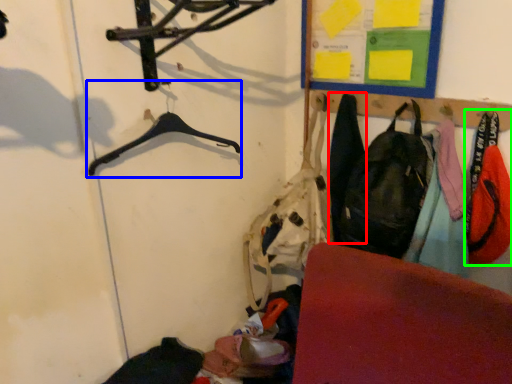
Question: Based on their relative distances, which object is nearer to clothing (highlighted by a red box)? Choose from hanger (highlighted by a blue box) and clothing (highlighted by a green box).

Choices:
 (A) hanger
 (B) clothing

Answer: (B)